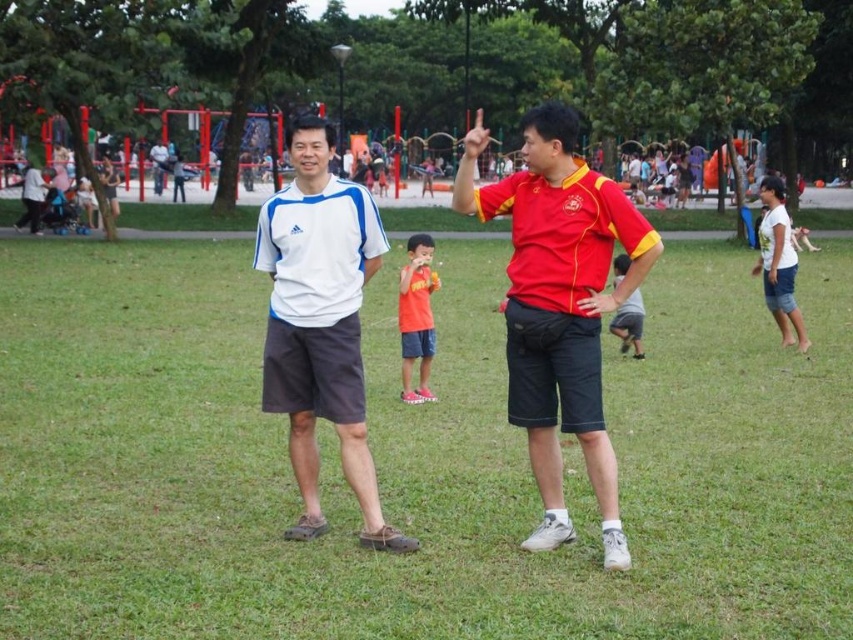
Is matte red shirt at center above orange matte shirt at center?

Yes, matte red shirt at center is above orange matte shirt at center.

Can you confirm if matte red shirt at center is wider than orange matte shirt at center?

Correct, the width of matte red shirt at center exceeds that of orange matte shirt at center.

Locate an element on the screen. matte red shirt at center is located at coordinates (560, 305).

Which is in front, point (611, 544) or point (635, 336)?

Point (611, 544) is in front.

Who is shorter, matte red shirt at center or gray cotton shorts at center?

Standing shorter between the two is gray cotton shorts at center.

Between point (529, 212) and point (616, 272), which one is positioned behind?

The point (616, 272) is more distant.

Locate an element on the screen. The width and height of the screenshot is (853, 640). matte red shirt at center is located at coordinates (560, 305).

Does matte white shorts at center lie behind orange matte shirt at center?

No.

Is matte white shorts at center to the left of orange matte shirt at center from the viewer's perspective?

In fact, matte white shorts at center is to the right of orange matte shirt at center.

The width and height of the screenshot is (853, 640). Identify the location of matte white shorts at center. (410, 460).

This screenshot has width=853, height=640. I want to click on matte white shorts at center, so click(x=410, y=460).